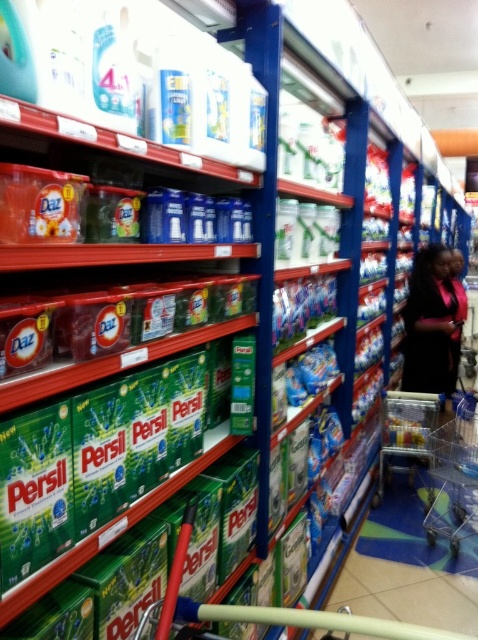
Question: Which object is closer to the camera taking this photo?

Choices:
 (A) dark blue fabric dress at lower right
 (B) metallic silver shopping cart at lower right
 (C) clear plastic shopping cart at lower right

Answer: (B)

Question: Estimate the real-world distances between objects in this image. Which object is farther from the dark blue fabric dress at lower right?

Choices:
 (A) metallic silver shopping cart at lower right
 (B) clear plastic shopping cart at lower right

Answer: (A)

Question: Can you confirm if dark blue fabric dress at lower right is positioned to the right of metallic silver shopping cart at lower right?

Choices:
 (A) no
 (B) yes

Answer: (B)

Question: Does dark blue fabric dress at lower right appear on the right side of clear plastic shopping cart at lower right?

Choices:
 (A) yes
 (B) no

Answer: (A)

Question: Which of the following is the farthest from the observer?

Choices:
 (A) (457, 276)
 (B) (412, 456)
 (C) (435, 538)

Answer: (A)

Question: Does dark blue fabric dress at lower right appear on the right side of clear plastic shopping cart at lower right?

Choices:
 (A) yes
 (B) no

Answer: (A)